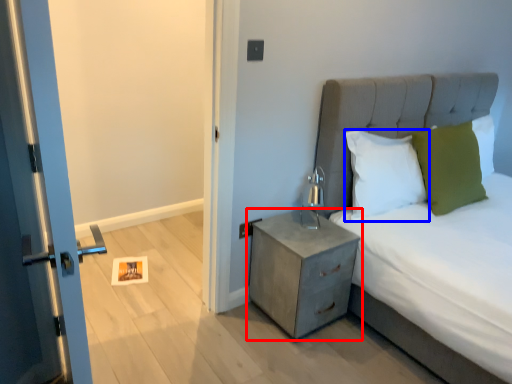
Question: Which of the following is the closest to the observer, nightstand (highlighted by a red box) or pillow (highlighted by a blue box)?

Choices:
 (A) nightstand
 (B) pillow

Answer: (A)